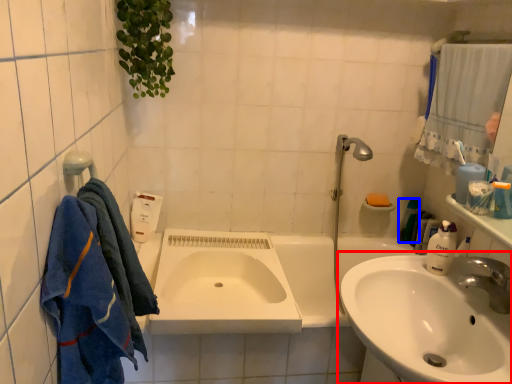
Question: Among these objects, which one is farthest to the camera, sink (highlighted by a red box) or toiletry (highlighted by a blue box)?

Choices:
 (A) sink
 (B) toiletry

Answer: (B)